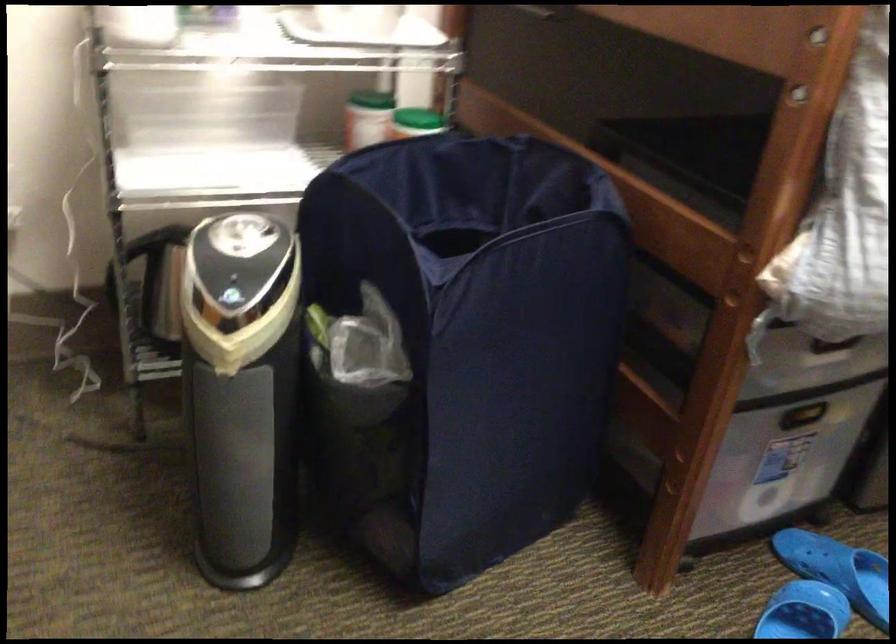
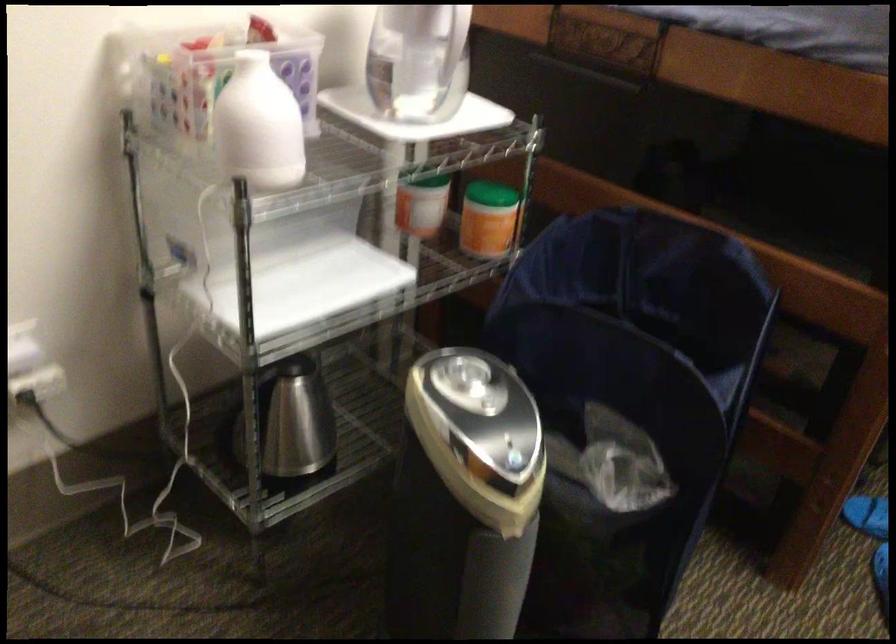
Question: How did the camera likely rotate?

Choices:
 (A) Left
 (B) Right
 (C) Up
 (D) Down

Answer: (B)